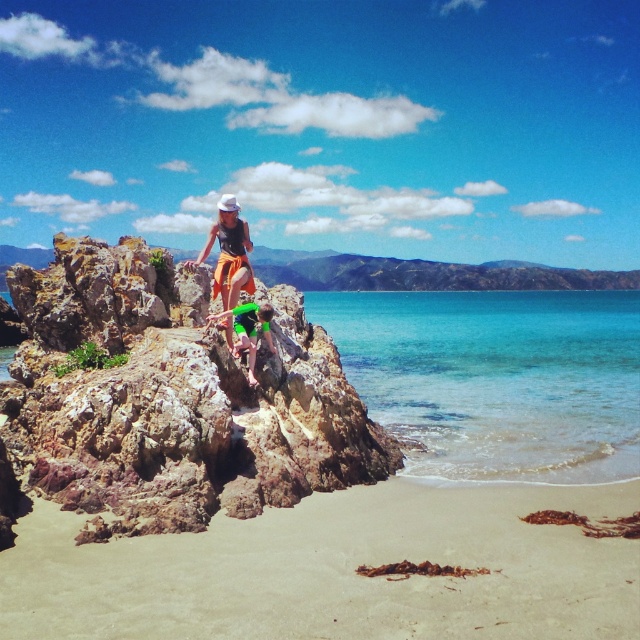
Can you confirm if rusty rock at center is positioned below green fabric shorts at center?

Yes, rusty rock at center is below green fabric shorts at center.

Which is in front, point (113, 326) or point (252, 356)?

Point (113, 326) is in front.

The image size is (640, 640). In order to click on rusty rock at center in this screenshot , I will do `click(172, 403)`.

Between matte orange shorts at center and green fabric shorts at center, which one appears on the left side from the viewer's perspective?

matte orange shorts at center is more to the left.

Does matte orange shorts at center appear on the left side of green fabric shorts at center?

Correct, you'll find matte orange shorts at center to the left of green fabric shorts at center.

This screenshot has height=640, width=640. What do you see at coordinates (228, 253) in the screenshot?
I see `matte orange shorts at center` at bounding box center [228, 253].

Image resolution: width=640 pixels, height=640 pixels. I want to click on matte orange shorts at center, so click(x=228, y=253).

Is smooth sand beach at lower center smaller than green fabric shorts at center?

No.

Who is taller, smooth sand beach at lower center or green fabric shorts at center?

With more height is green fabric shorts at center.

At what (x,y) coordinates should I click in order to perform the action: click on smooth sand beach at lower center. Please return your answer as a coordinate pair (x, y). This screenshot has height=640, width=640. Looking at the image, I should click on (337, 570).